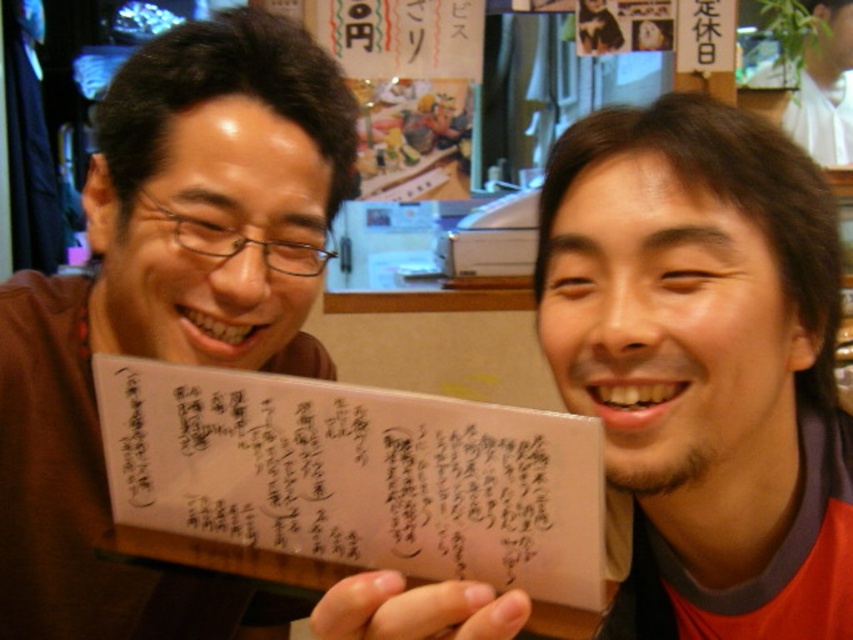
Can you confirm if matte brown card at left is shorter than white paper at upper right?

Incorrect, matte brown card at left's height does not fall short of white paper at upper right's.

Is matte brown card at left bigger than white paper at upper right?

Indeed, matte brown card at left has a larger size compared to white paper at upper right.

The image size is (853, 640). I want to click on matte brown card at left, so coord(167,305).

Who is positioned more to the right, transparent paper at center or white paper at upper right?

→ From the viewer's perspective, white paper at upper right appears more on the right side.

Is transparent paper at center above white paper at upper right?

Actually, transparent paper at center is below white paper at upper right.

Does point (531, 420) come closer to viewer compared to point (846, 90)?

That is True.

Identify the location of transparent paper at center. (331, 477).

Which is in front, point (334, 192) or point (148, 522)?

Point (148, 522) is in front.

From the picture: Is matte brown card at left taller than transparent paper at center?

Yes, matte brown card at left is taller than transparent paper at center.

You are a GUI agent. You are given a task and a screenshot of the screen. Output one action in this format:
    pyautogui.click(x=<x>, y=<y>)
    Task: Click on the matte brown card at left
    The width and height of the screenshot is (853, 640).
    Given the screenshot: What is the action you would take?
    click(x=167, y=305)